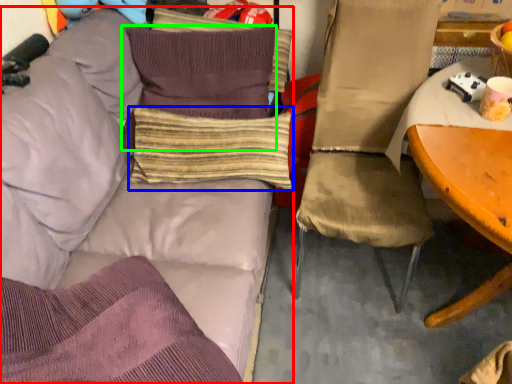
Question: Considering the real-world distances, which object is farthest from studio couch (highlighted by a red box)? pillow (highlighted by a blue box) or pillow (highlighted by a green box)?

Choices:
 (A) pillow
 (B) pillow

Answer: (A)